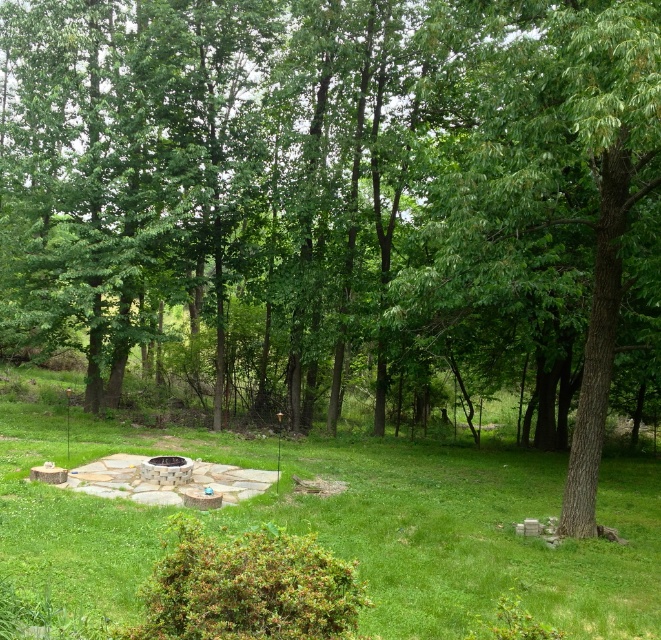
Question: Is green grassy at center bigger than green rough bark tree at center?

Choices:
 (A) no
 (B) yes

Answer: (B)

Question: Can you confirm if green grassy at center is wider than green rough bark tree at center?

Choices:
 (A) yes
 (B) no

Answer: (A)

Question: Is green grassy at center wider than green rough bark tree at center?

Choices:
 (A) yes
 (B) no

Answer: (A)